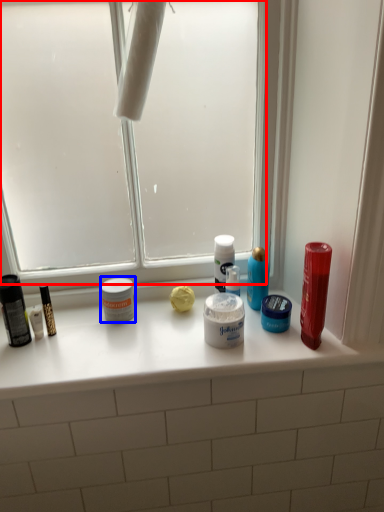
Question: Which point is further to the camera, window screen (highlighted by a red box) or toiletry (highlighted by a blue box)?

Choices:
 (A) window screen
 (B) toiletry

Answer: (B)